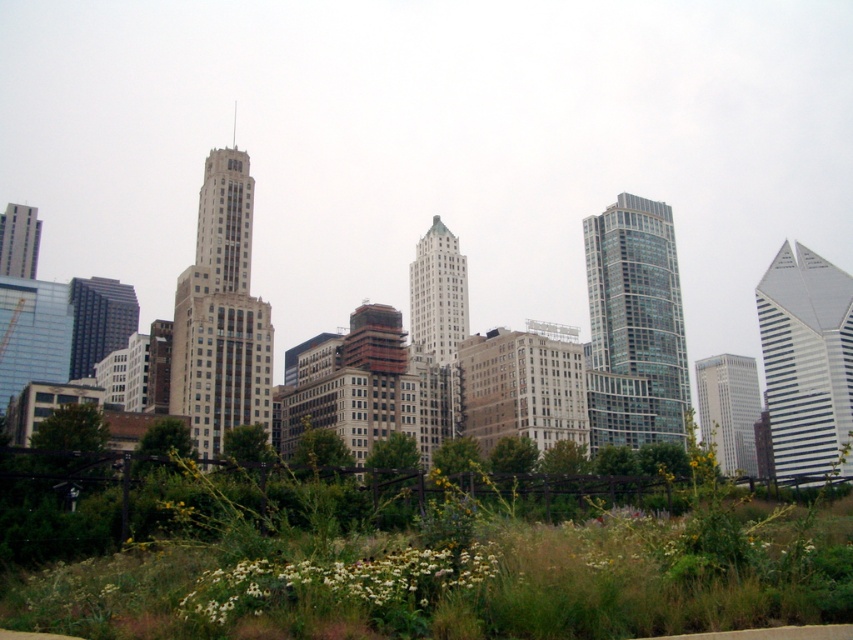
Question: Estimate the real-world distances between objects in this image. Which object is closer to the matte glass skyscraper at left?

Choices:
 (A) glassy reflective skyscraper at center-right
 (B) beige stone tower at center-left

Answer: (B)

Question: In this image, where is glassy reflective skyscraper at center-right located relative to glassy silver skyscraper at center?

Choices:
 (A) right
 (B) left

Answer: (B)

Question: Among these points, which one is nearest to the camera?

Choices:
 (A) (706, 394)
 (B) (785, 266)

Answer: (B)

Question: Observing the image, what is the correct spatial positioning of white glass skyscraper at right in reference to glassy silver skyscraper at center?

Choices:
 (A) below
 (B) above

Answer: (B)

Question: Is white fluffy flowers at lower center to the right of glassy reflective skyscraper at center-right from the viewer's perspective?

Choices:
 (A) no
 (B) yes

Answer: (A)

Question: Which of the following is the closest to the observer?

Choices:
 (A) glassy reflective skyscraper at center-right
 (B) matte glass skyscraper at left
 (C) white glass skyscraper at right
 (D) white glass skyscraper at center

Answer: (D)